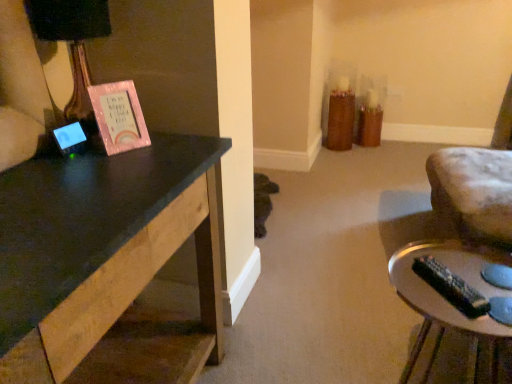
Question: Considering the positions of matte black lampshade at left and silver metallic remote control at lower right in the image, is matte black lampshade at left wider or thinner than silver metallic remote control at lower right?

Choices:
 (A) wide
 (B) thin

Answer: (B)

Question: Considering their positions, is matte black lampshade at left located in front of or behind silver metallic remote control at lower right?

Choices:
 (A) behind
 (B) front

Answer: (A)

Question: In terms of size, does matte black lampshade at left appear bigger or smaller than silver metallic remote control at lower right?

Choices:
 (A) small
 (B) big

Answer: (A)

Question: From a real-world perspective, is silver metallic remote control at lower right above or below matte black lampshade at left?

Choices:
 (A) below
 (B) above

Answer: (A)

Question: Looking at their shapes, would you say silver metallic remote control at lower right is wider or thinner than matte black lampshade at left?

Choices:
 (A) wide
 (B) thin

Answer: (A)

Question: From the image's perspective, is silver metallic remote control at lower right located above or below matte black lampshade at left?

Choices:
 (A) below
 (B) above

Answer: (A)

Question: Considering the positions of silver metallic remote control at lower right and matte black lampshade at left in the image, is silver metallic remote control at lower right bigger or smaller than matte black lampshade at left?

Choices:
 (A) small
 (B) big

Answer: (B)